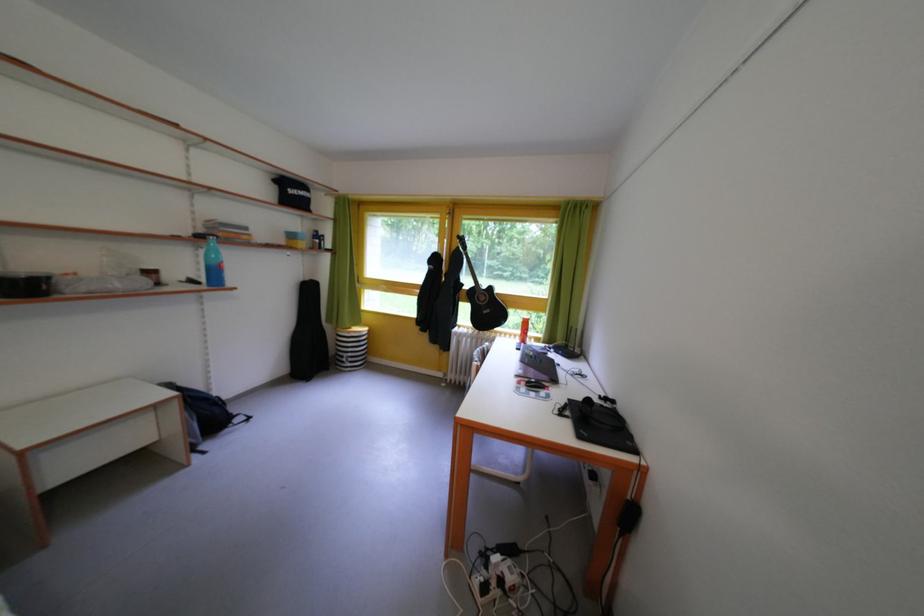
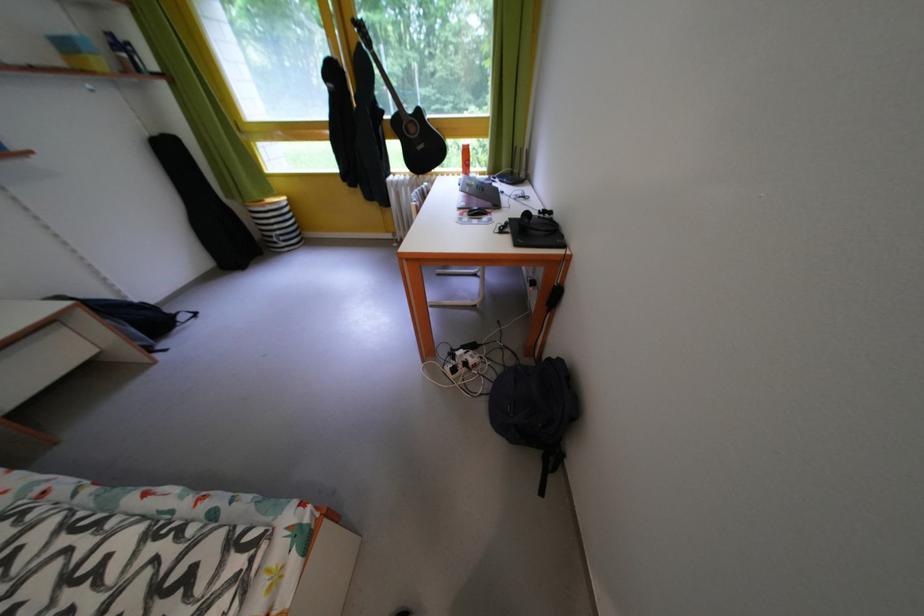
Find the pixel in the second image that matches point 578,406 in the first image.

(519, 225)